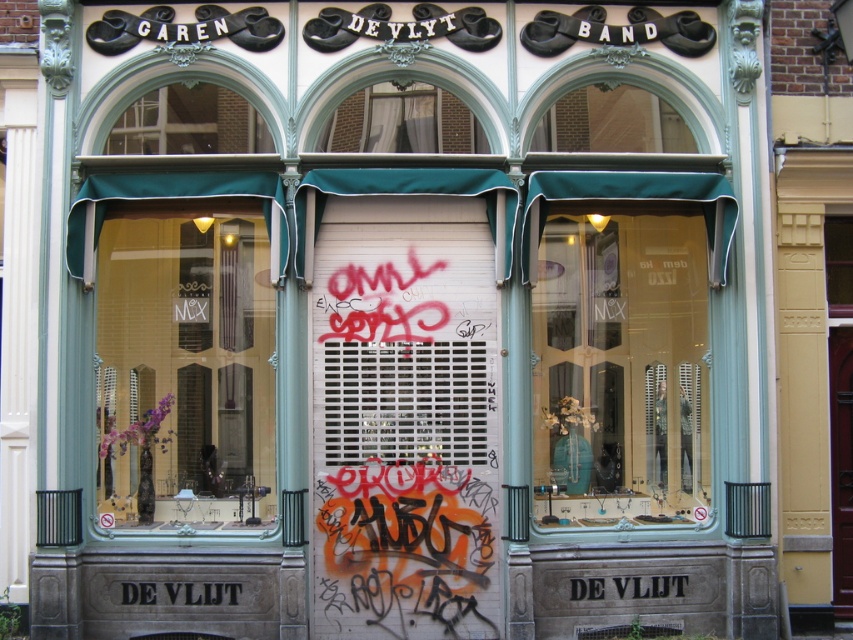
You are a window installer assessing the storefront of De Vlijt. You need to replace the existing windows with new ones. The new matte glass window at center has a width of 2 meters, and the transparent glass window at center has a width of 1.5 meters. Can both windows fit side by side within the available space of 3.8 meters?

The matte glass window at center is wider than the transparent glass window at center. Combined, their total width is 3.5 meters, which is less than the available 3.8 meters. Therefore, both windows can fit side by side within the space.

You are a customer trying to read the text on the black wood sign at center of the storefront. Can you see it clearly through the transparent glass window at center?

The black wood sign at center is behind the transparent glass window at center, so yes, you can see it clearly through the transparent glass window at center.

You are a delivery person trying to see the shop name through the transparent glass window at center and the black wood sign at center. Which object allows you to see the shop name more clearly?

The black wood sign at center allows you to see the shop name more clearly because the transparent glass window at center is narrower than the black wood sign at center, making the text on the sign more legible.